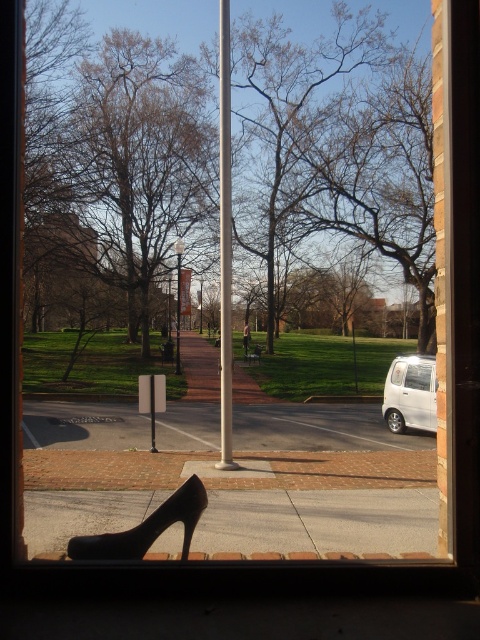
Question: Can you confirm if smooth silver pole at center is positioned to the left of white matte car at lower right?

Choices:
 (A) no
 (B) yes

Answer: (B)

Question: Which of the following is the farthest from the observer?

Choices:
 (A) (228, 38)
 (B) (143, 524)

Answer: (A)

Question: In this image, where is smooth silver pole at center located relative to white matte car at lower right?

Choices:
 (A) below
 (B) above

Answer: (B)

Question: Which object appears closest to the camera in this image?

Choices:
 (A) white matte car at lower right
 (B) black leather high heel at lower left
 (C) smooth silver pole at center

Answer: (B)

Question: Is smooth silver pole at center to the left of black leather high heel at lower left from the viewer's perspective?

Choices:
 (A) no
 (B) yes

Answer: (B)

Question: Which object is closer to the camera taking this photo?

Choices:
 (A) smooth silver pole at center
 (B) black leather high heel at lower left

Answer: (B)